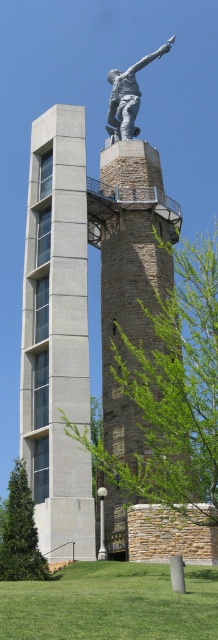
Question: Which point is farther to the camera?

Choices:
 (A) stone textured tower at center
 (B) polished bronze statue at upper center

Answer: (B)

Question: Which point is farther to the camera?

Choices:
 (A) (117, 214)
 (B) (124, 122)

Answer: (B)

Question: Which object is the farthest from the stone textured tower at center?

Choices:
 (A) concrete tower at center
 (B) polished bronze statue at upper center

Answer: (B)

Question: Is concrete tower at center smaller than stone textured tower at center?

Choices:
 (A) no
 (B) yes

Answer: (B)

Question: Where is stone textured tower at center located in relation to polished bronze statue at upper center in the image?

Choices:
 (A) below
 (B) above

Answer: (A)

Question: Can you confirm if concrete tower at center is bigger than stone textured tower at center?

Choices:
 (A) yes
 (B) no

Answer: (B)